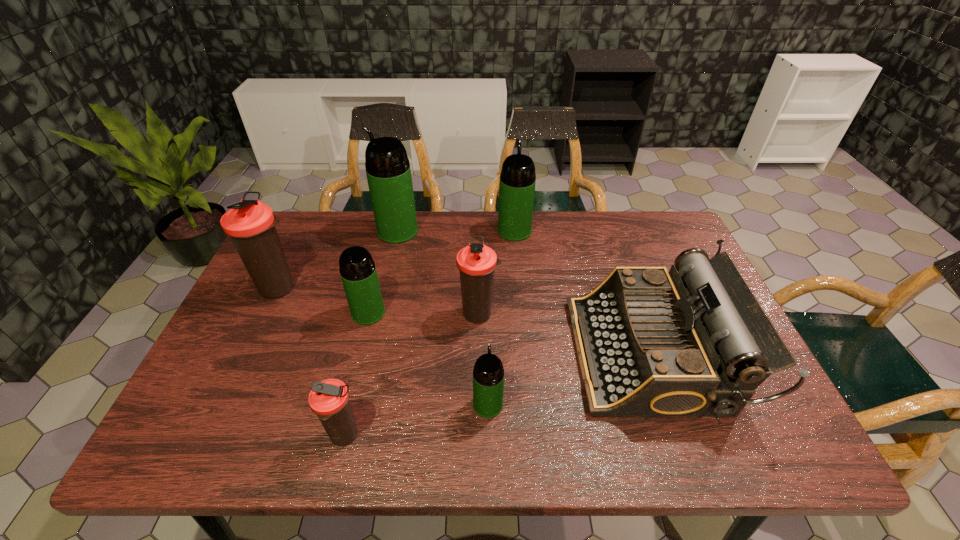
The height and width of the screenshot is (540, 960). What are the coordinates of `the smallest green thermos bottle` in the screenshot? It's located at (488, 374).

Locate an element on the screen. Image resolution: width=960 pixels, height=540 pixels. the second brown thermos bottle from left to right is located at coordinates (329, 399).

The width and height of the screenshot is (960, 540). I want to click on the nearest brown thermos bottle, so click(329, 399).

Identify the location of vacant space located 0.300m from the spout of the tallest thermos bottle. This screenshot has height=540, width=960. (285, 231).

The image size is (960, 540). I want to click on vacant position located from the spout of the tallest thermos bottle, so click(289, 231).

Locate an element on the screen. The height and width of the screenshot is (540, 960). free space located 0.280m from the spout of the tallest thermos bottle is located at coordinates (292, 231).

Image resolution: width=960 pixels, height=540 pixels. Find the location of `free location located from the spout of the rightmost green thermos bottle`. free location located from the spout of the rightmost green thermos bottle is located at coordinates (513, 213).

Where is `free space located 0.110m on the front of the leftmost brown thermos bottle`? free space located 0.110m on the front of the leftmost brown thermos bottle is located at coordinates (257, 335).

You are a GUI agent. You are given a task and a screenshot of the screen. Output one action in this format:
    pyautogui.click(x=<x>, y=<y>)
    Task: Click on the vacant space situated 0.120m from the spout of the second smallest green thermos bottle
    This screenshot has height=540, width=960.
    Given the screenshot: What is the action you would take?
    pyautogui.click(x=356, y=363)

Image resolution: width=960 pixels, height=540 pixels. Identify the location of free location located on the front of the rightmost brown thermos bottle. (479, 381).